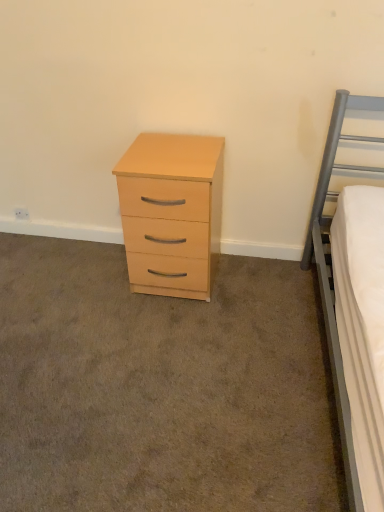
Where is `vacant area that is in front of light wood/veneer chest of drawers at center`? Image resolution: width=384 pixels, height=512 pixels. vacant area that is in front of light wood/veneer chest of drawers at center is located at coordinates (173, 331).